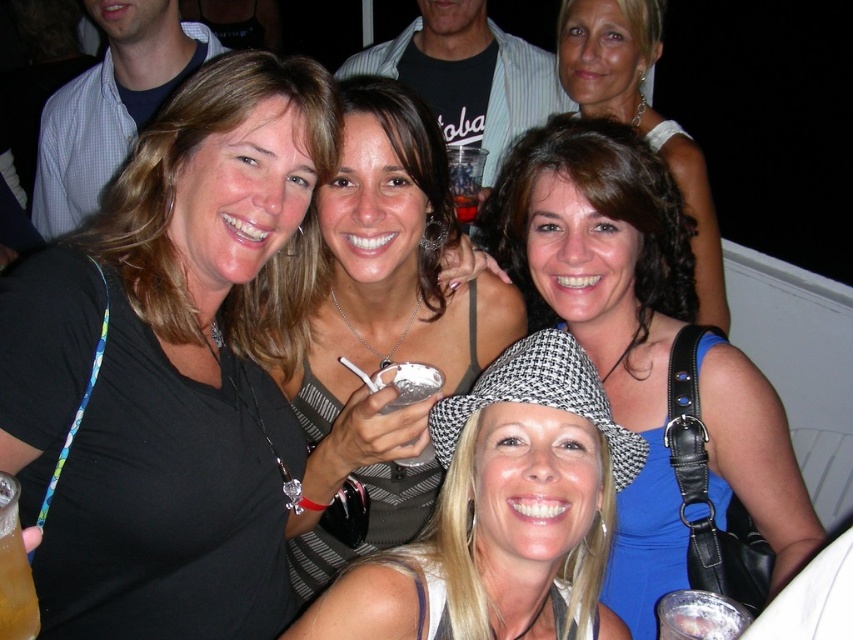
Does point (387, 612) come closer to viewer compared to point (456, 218)?

Yes, it is.

Can you confirm if white textured hat at center is thinner than clear plastic cup at center?

In fact, white textured hat at center might be wider than clear plastic cup at center.

The width and height of the screenshot is (853, 640). I want to click on white textured hat at center, so click(502, 509).

Find the location of `white textured hat at center`. white textured hat at center is located at coordinates (502, 509).

Can you confirm if silver metallic phone at center is positioned to the right of brown curly hair at center?

No, silver metallic phone at center is not to the right of brown curly hair at center.

Can you confirm if silver metallic phone at center is wider than brown curly hair at center?

Yes.

Identify the location of silver metallic phone at center. (375, 316).

Does black matte shirt at upper left have a smaller size compared to white matte cupcake at center?

No, black matte shirt at upper left is not smaller than white matte cupcake at center.

Is point (100, 563) farther from viewer compared to point (436, 374)?

No, it is not.

The width and height of the screenshot is (853, 640). Identify the location of black matte shirt at upper left. (173, 365).